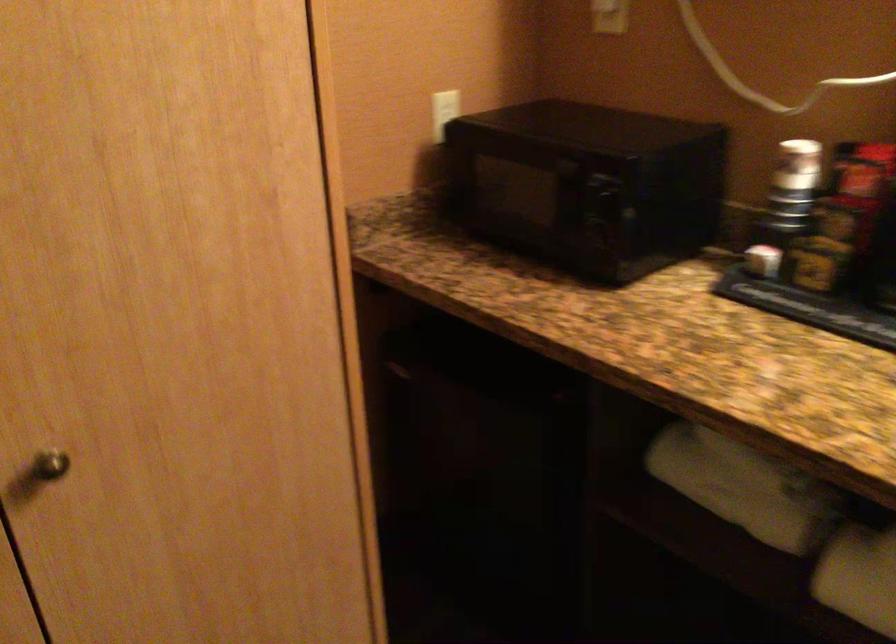
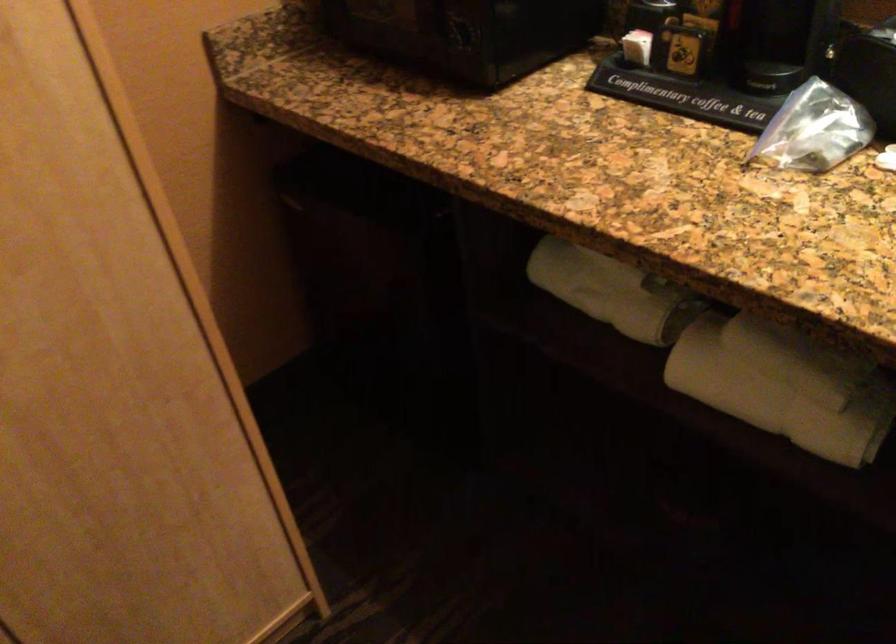
Find the pixel in the second image that matches point 721,487 in the first image.

(596, 290)